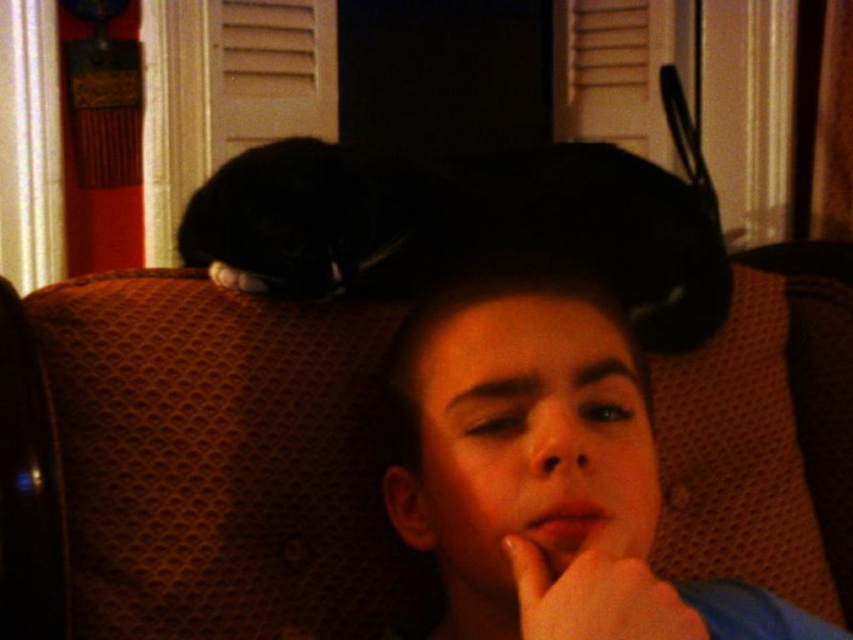
Question: Which object is the farthest from the matte skin hand at lower center?

Choices:
 (A) smooth skin face at center
 (B) black fur cat at upper center

Answer: (B)

Question: Which object is farther from the camera taking this photo?

Choices:
 (A) black fur cat at upper center
 (B) smooth skin face at center

Answer: (A)

Question: Considering the real-world distances, which object is closest to the matte skin hand at lower center?

Choices:
 (A) black fur cat at upper center
 (B) smooth skin face at center

Answer: (B)

Question: Is smooth skin face at center smaller than black fur cat at upper center?

Choices:
 (A) yes
 (B) no

Answer: (A)

Question: Does smooth skin face at center appear on the right side of black fur cat at upper center?

Choices:
 (A) no
 (B) yes

Answer: (A)

Question: Can you confirm if smooth skin face at center is positioned to the left of matte skin hand at lower center?

Choices:
 (A) no
 (B) yes

Answer: (B)